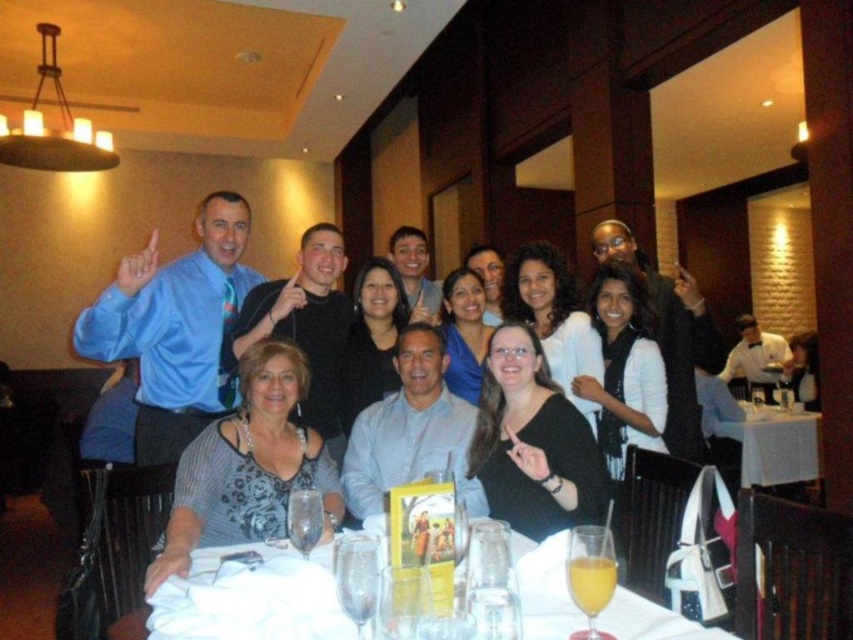
You are a photographer taking a group photo of the diners. You want to place a decorative napkin holder at the exact center of the table. However, there is already a white paper napkin at lower center. Where should you place the napkin holder to avoid overlapping with the existing napkin?

The white paper napkin at lower center is located at point (x=251, y=598). To place the napkin holder at the exact center of the table without overlapping, position it at the center coordinates, which are typically at point (x=426, y=320).

You are a photographer trying to capture a closeup of the white paper napkin at lower center. Based on its 2D coordinates, where should you position your camera to ensure it is centered in the frame?

Answer: To center the white paper napkin at lower center in the frame, position the camera so that the center of the lens aligns with the coordinates point (251, 598).

Looking at this image, what are the coordinates of the white paper napkin at lower center?

The white paper napkin at lower center is located at coordinates point (251, 598).